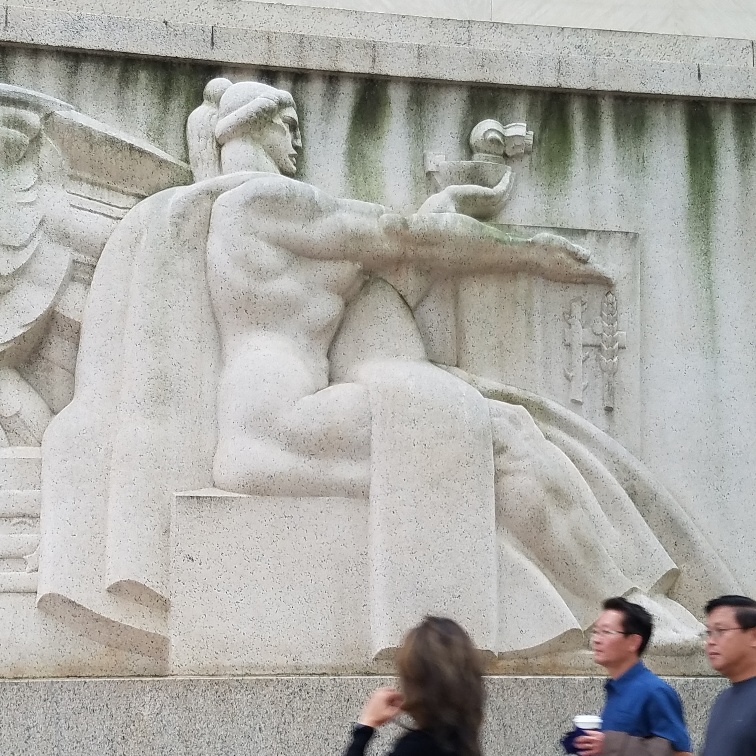
Locate an element on the screen. Image resolution: width=756 pixels, height=756 pixels. wall is located at coordinates (78, 264).